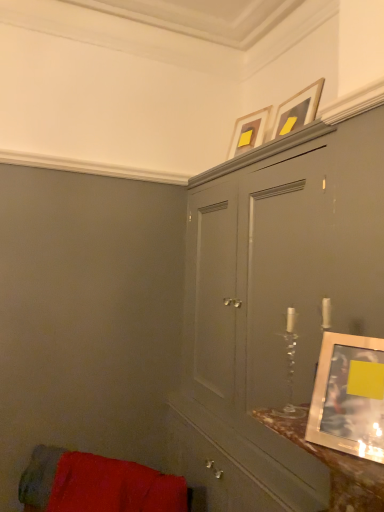
Question: From the image's perspective, is metallic silver picture frame at right, the third picture frame positioned from the top, above or below matte gray cabinet at upper center?

Choices:
 (A) below
 (B) above

Answer: (B)

Question: Choose the correct answer: Is metallic silver picture frame at right, the first picture frame from the front, inside matte gray cabinet at upper center or outside it?

Choices:
 (A) outside
 (B) inside

Answer: (A)

Question: Considering the real-world distances, which object is closest to the velvet red cushion at lower left?

Choices:
 (A) matte silver picture frame at upper center, marked as the 2th picture frame in a top-to-bottom arrangement
 (B) matte gold picture frame at upper center, which ranks as the third picture frame in bottom-to-top order
 (C) matte gray cabinet at upper center
 (D) metallic silver picture frame at right, which is the first picture frame from bottom to top

Answer: (C)

Question: Considering the real-world distances, which object is farthest from the matte gray cabinet at upper center?

Choices:
 (A) velvet red cushion at lower left
 (B) matte silver picture frame at upper center, the second picture frame when ordered from back to front
 (C) matte gold picture frame at upper center, the first picture frame in the top-to-bottom sequence
 (D) metallic silver picture frame at right, which is the third picture frame in back-to-front order

Answer: (C)